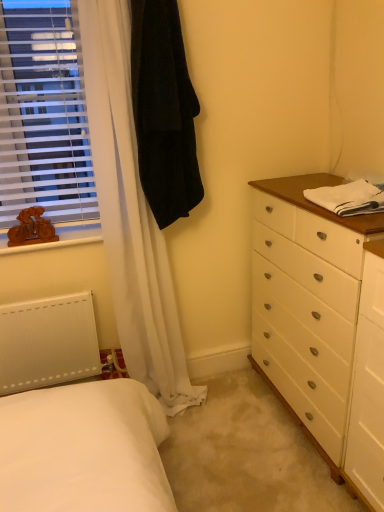
Question: From a real-world perspective, is white matte radiator at lower left below white plastic blinds at left?

Choices:
 (A) no
 (B) yes

Answer: (B)

Question: Is white matte radiator at lower left smaller than white plastic blinds at left?

Choices:
 (A) no
 (B) yes

Answer: (B)

Question: Can we say white matte radiator at lower left lies outside white plastic blinds at left?

Choices:
 (A) yes
 (B) no

Answer: (A)

Question: Can you confirm if white matte radiator at lower left is shorter than white plastic blinds at left?

Choices:
 (A) no
 (B) yes

Answer: (B)

Question: Is white matte radiator at lower left oriented away from white plastic blinds at left?

Choices:
 (A) no
 (B) yes

Answer: (A)

Question: From a real-world perspective, does white matte radiator at lower left stand above white plastic blinds at left?

Choices:
 (A) yes
 (B) no

Answer: (B)

Question: Is white plastic blinds at left to the left of white cotton towel at right from the viewer's perspective?

Choices:
 (A) no
 (B) yes

Answer: (B)

Question: Can you confirm if white plastic blinds at left is shorter than white cotton towel at right?

Choices:
 (A) no
 (B) yes

Answer: (A)

Question: From the image's perspective, is white plastic blinds at left located beneath white cotton towel at right?

Choices:
 (A) yes
 (B) no

Answer: (B)

Question: Is white plastic blinds at left directly adjacent to white cotton towel at right?

Choices:
 (A) no
 (B) yes

Answer: (A)

Question: Is white plastic blinds at left oriented away from white cotton towel at right?

Choices:
 (A) yes
 (B) no

Answer: (B)

Question: Does white plastic blinds at left have a greater height compared to white cotton towel at right?

Choices:
 (A) yes
 (B) no

Answer: (A)

Question: Would you say white plastic blinds at left is outside wooden figure at left?

Choices:
 (A) yes
 (B) no

Answer: (A)